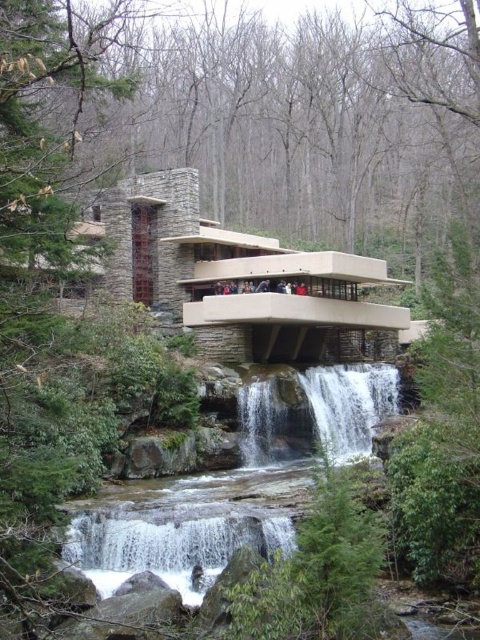
Question: Is the position of clear water at center less distant than that of white textured water at center?

Choices:
 (A) yes
 (B) no

Answer: (A)

Question: Is clear water at center below white textured water at center?

Choices:
 (A) yes
 (B) no

Answer: (A)

Question: Which object is farther from the camera taking this photo?

Choices:
 (A) clear water at center
 (B) white textured water at center

Answer: (B)

Question: Is clear water at center above white textured water at center?

Choices:
 (A) yes
 (B) no

Answer: (B)